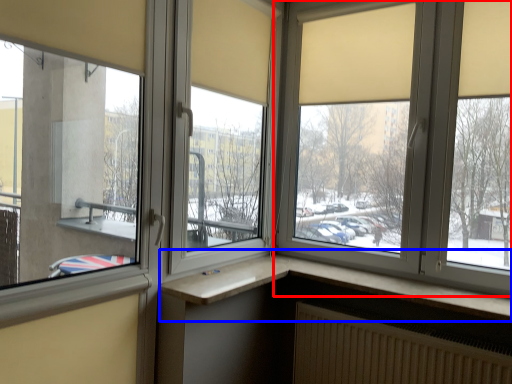
Question: Which object appears closest to the camera in this image, window (highlighted by a red box) or window (highlighted by a blue box)?

Choices:
 (A) window
 (B) window

Answer: (B)